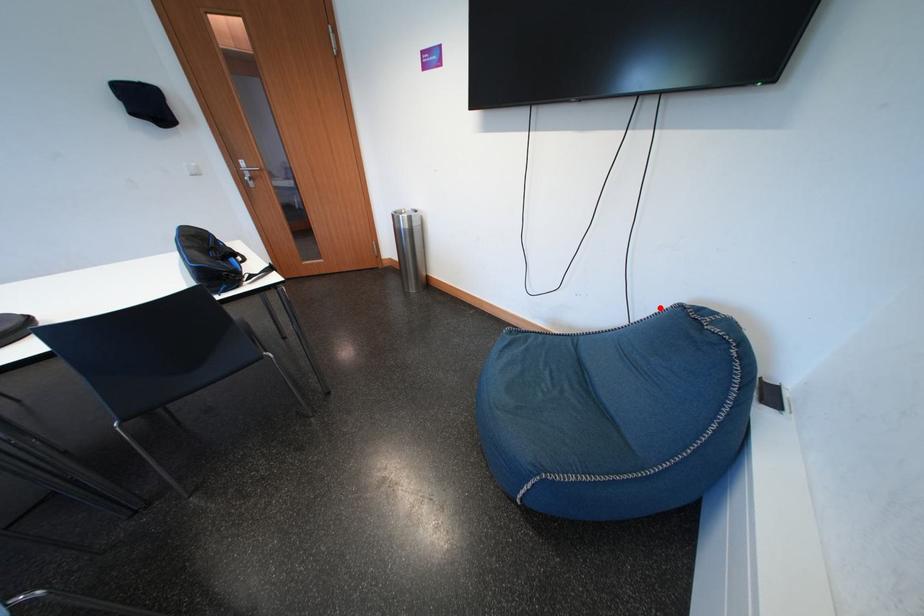
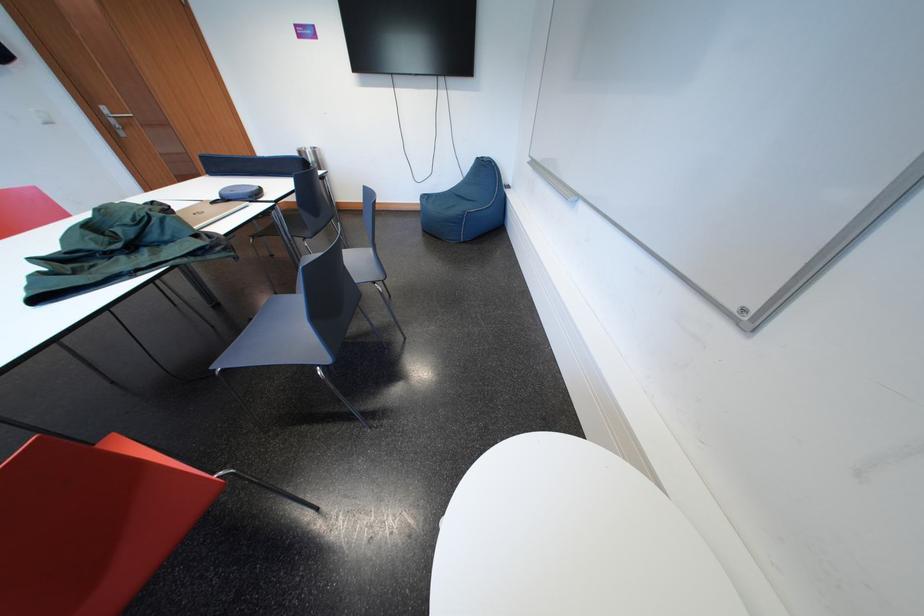
Question: I am providing you with two images of the same scene from different viewpoints. A red point is shown in image1. For the corresponding object point in image2, is it positioned nearer or farther from the camera?

Choices:
 (A) Nearer
 (B) Farther

Answer: (A)